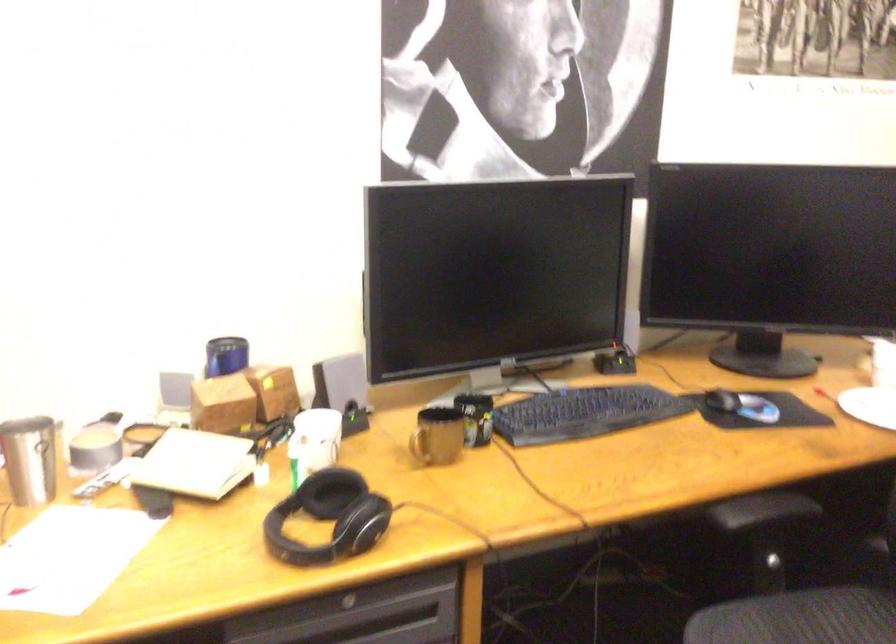
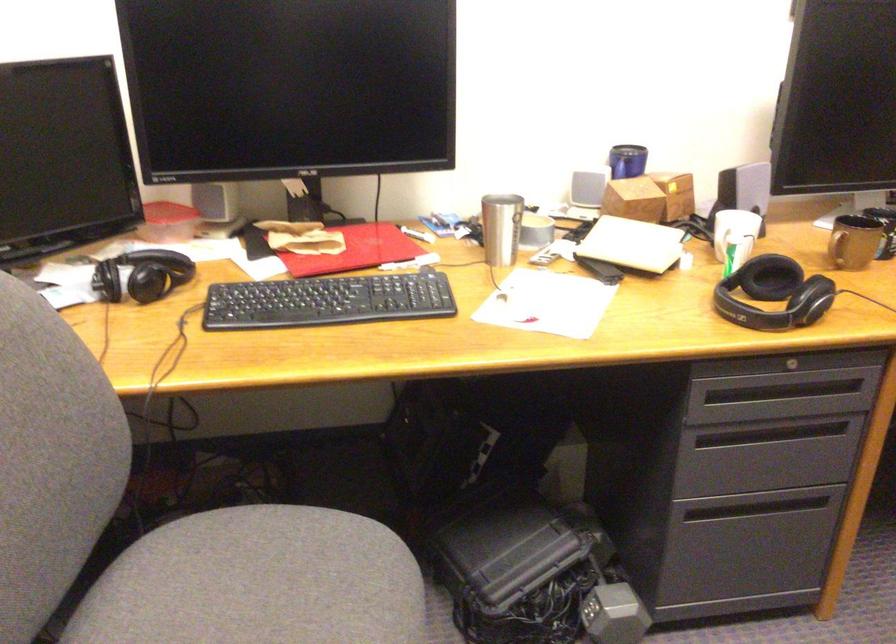
The point at (435,446) is marked in the first image. Where is the corresponding point in the second image?

(854, 242)